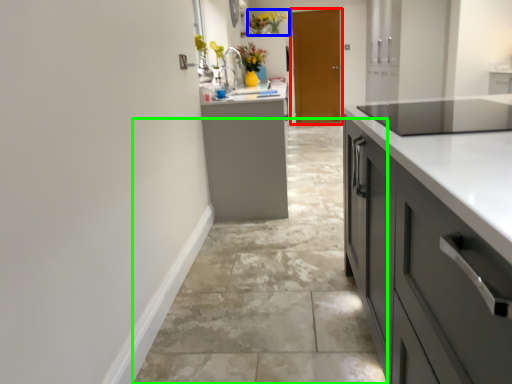
Question: Which object is the closest to the door (highlighted by a red box)? Choose among these: floral arrangement (highlighted by a blue box) or concrete (highlighted by a green box).

Choices:
 (A) floral arrangement
 (B) concrete

Answer: (A)